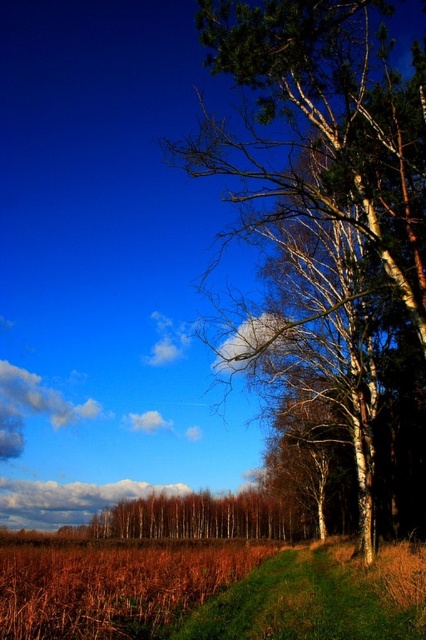
Between point (83, 605) and point (273, 634), which one is positioned behind?

Positioned behind is point (83, 605).

Between point (5, 588) and point (419, 566), which one is positioned behind?

The point (5, 588) is more distant.

The height and width of the screenshot is (640, 426). I want to click on brown dry grass at lower left, so click(x=112, y=586).

Is smooth white bark tree at right bigger than green grass at lower right?

Indeed, smooth white bark tree at right has a larger size compared to green grass at lower right.

Does smooth white bark tree at right have a greater height compared to green grass at lower right?

Indeed, smooth white bark tree at right has a greater height compared to green grass at lower right.

Between point (396, 248) and point (271, 624), which one is positioned in front?

Positioned in front is point (271, 624).

You are a GUI agent. You are given a task and a screenshot of the screen. Output one action in this format:
    pyautogui.click(x=<x>, y=<y>)
    Task: Click on the smooth white bark tree at right
    This screenshot has height=640, width=426.
    Given the screenshot: What is the action you would take?
    pyautogui.click(x=322, y=168)

Between smooth white bark tree at right and brown dry grass at lower left, which one has less height?

brown dry grass at lower left is shorter.

Find the location of a particular element. The image size is (426, 640). smooth white bark tree at right is located at coordinates (322, 168).